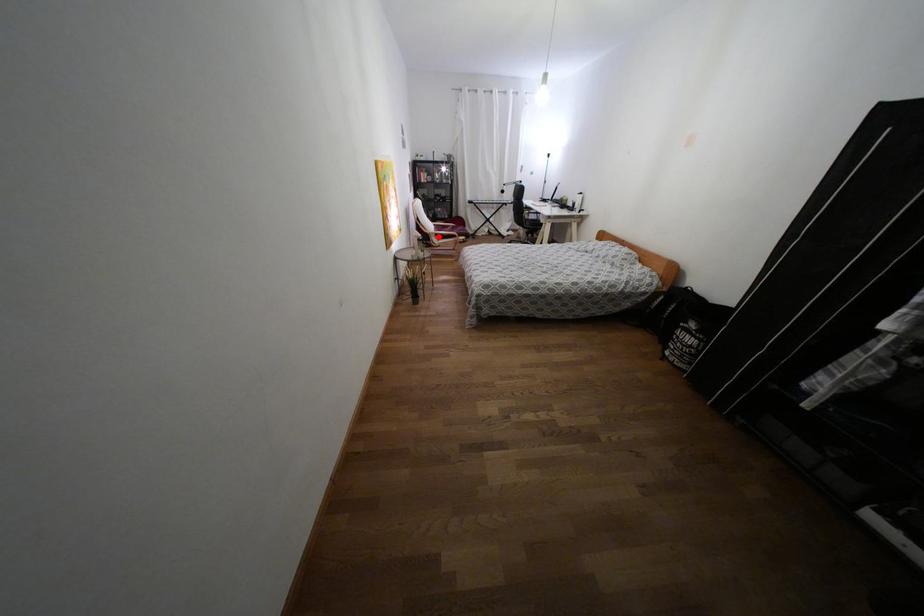
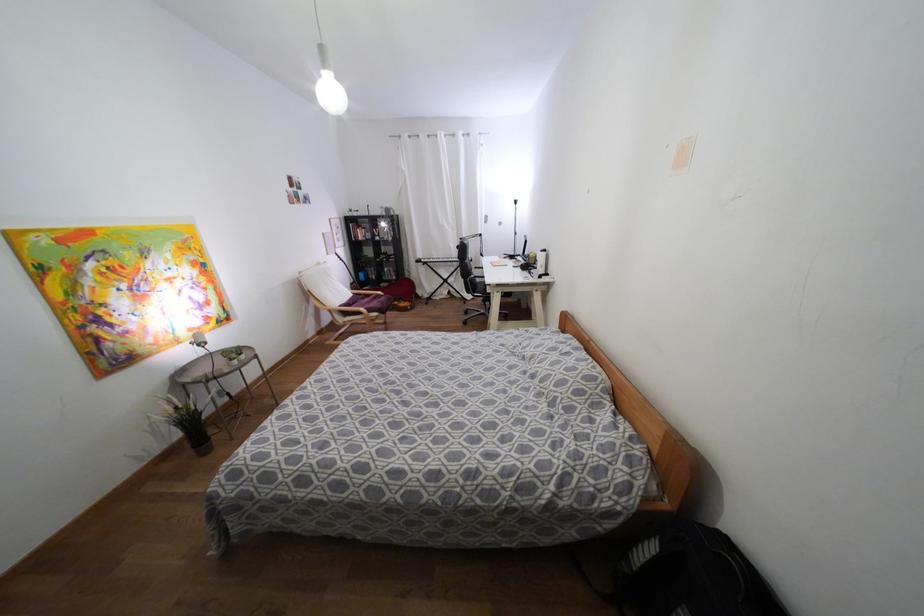
Question: I am providing you with two images of the same scene from different viewpoints. A red point is marked on the first image. Is the red point's position out of view in image 2?

Choices:
 (A) Yes
 (B) No

Answer: (B)